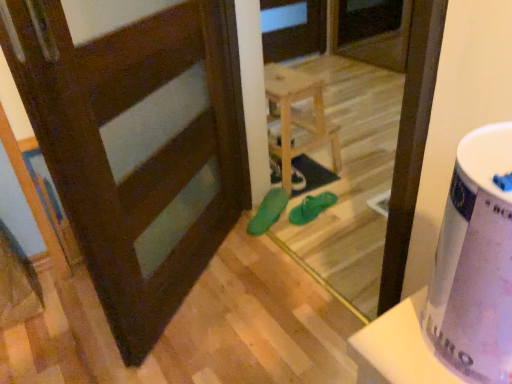
Where is `empty space that is to the right of dark brown wood door at center`? Image resolution: width=512 pixels, height=384 pixels. empty space that is to the right of dark brown wood door at center is located at coordinates (264, 285).